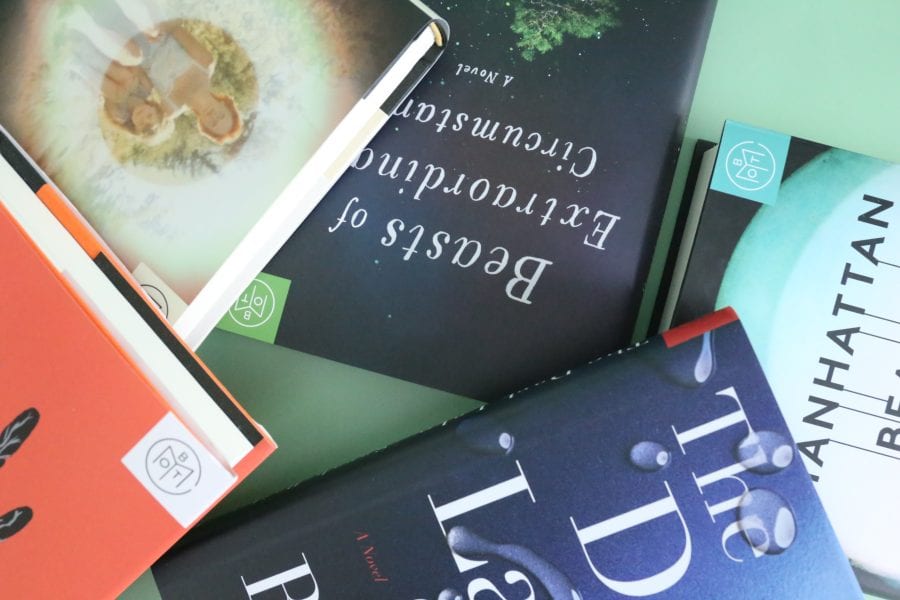
Where is `whitish yellowish book`? whitish yellowish book is located at coordinates (273, 166).